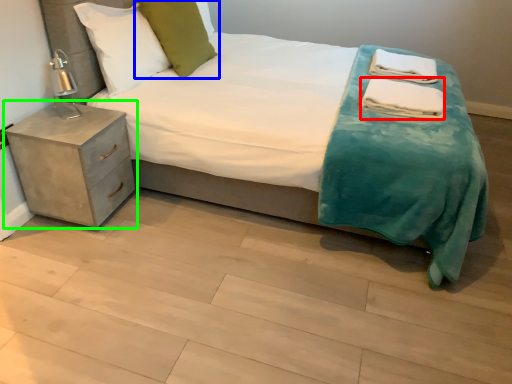
Question: Estimate the real-world distances between objects in this image. Which object is closer to material (highlighted by a red box), pillow (highlighted by a blue box) or nightstand (highlighted by a green box)?

Choices:
 (A) pillow
 (B) nightstand

Answer: (A)